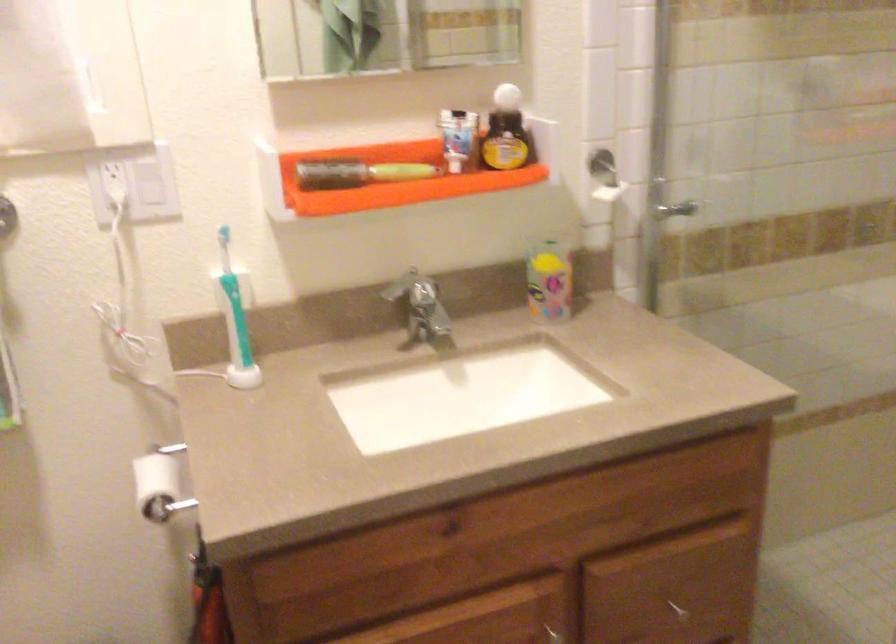
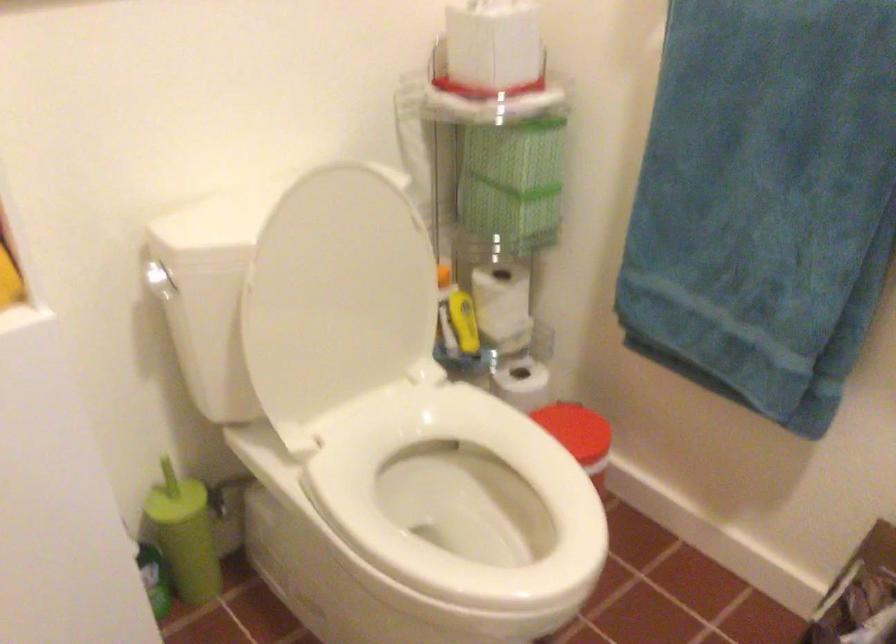
First-person continuous shooting, in which direction is the camera rotating?

The rotation direction of the camera is left-down.